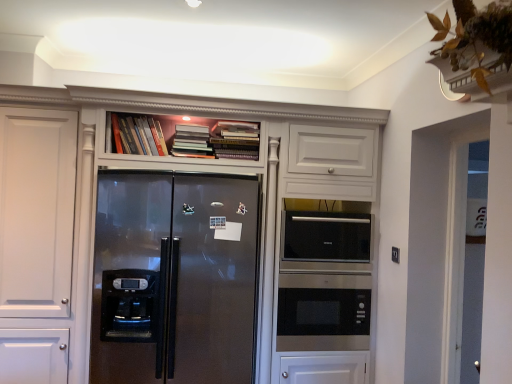
Question: Based on their sizes in the image, would you say satin white cabinet at upper center is bigger or smaller than hardcover books at upper center, the third book positioned from the left?

Choices:
 (A) big
 (B) small

Answer: (A)

Question: From their relative heights in the image, would you say satin white cabinet at upper center is taller or shorter than hardcover books at upper center, the third book positioned from the left?

Choices:
 (A) tall
 (B) short

Answer: (A)

Question: Estimate the real-world distances between objects in this image. Which object is closer to the hardcover books at upper center, the third book positioned from the left?

Choices:
 (A) stainless steel microwave at center
 (B) hardcover books at upper center, which is the 2th book in right-to-left order
 (C) hardcover books at upper center, the first book viewed from the left
 (D) satin black refrigerator at center
 (E) satin white cabinet at upper center

Answer: (B)

Question: Which object is the closest to the satin black refrigerator at center?

Choices:
 (A) hardcover books at upper center, the first book viewed from the left
 (B) hardcover books at upper center, the third book positioned from the left
 (C) satin white cabinet at upper center
 (D) sleek stainless steel microwave at center
 (E) hardcover books at upper center, arranged as the second book when viewed from the left

Answer: (C)